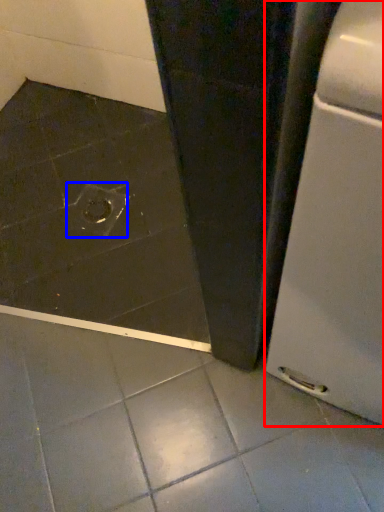
Question: Which object is further to the camera taking this photo, home appliance (highlighted by a red box) or drain (highlighted by a blue box)?

Choices:
 (A) home appliance
 (B) drain

Answer: (B)